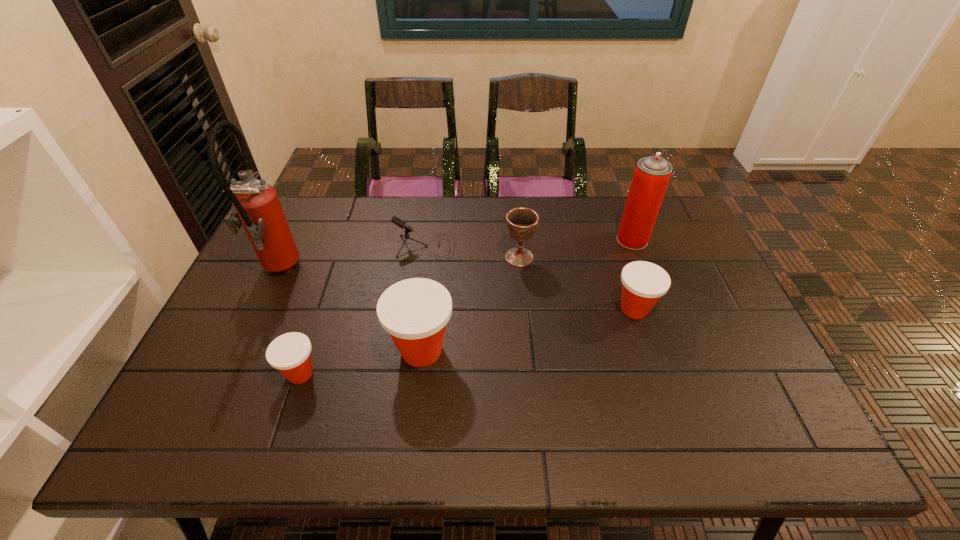
Identify the location of object that is at the far right corner. The width and height of the screenshot is (960, 540). click(652, 174).

The width and height of the screenshot is (960, 540). I want to click on vacant space at the far edge of the desktop, so click(x=367, y=217).

In the image, there is a desktop. What are the coordinates of `vacant area at the near edge` in the screenshot? It's located at (361, 392).

Image resolution: width=960 pixels, height=540 pixels. In the image, there is a desktop. Identify the location of free space at the left edge. [224, 373].

At what (x,y) coordinates should I click in order to perform the action: click on free space at the right edge. Please return your answer as a coordinate pair (x, y). Looking at the image, I should click on (679, 300).

Locate an element on the screen. vacant space at the near left corner of the desktop is located at coordinates (186, 396).

This screenshot has width=960, height=540. In order to click on vacant space that's between the microphone and the rightmost Dixie cup in this screenshot , I will do `click(530, 278)`.

At what (x,y) coordinates should I click in order to perform the action: click on blank region between the second tallest Dixie cup and the chalice. Please return your answer as a coordinate pair (x, y). The image size is (960, 540). Looking at the image, I should click on (577, 283).

Identify the location of vacant space that is in between the leftmost object and the tallest Dixie cup. (349, 311).

Locate an element on the screen. The width and height of the screenshot is (960, 540). free spot between the tallest Dixie cup and the rightmost Dixie cup is located at coordinates (528, 330).